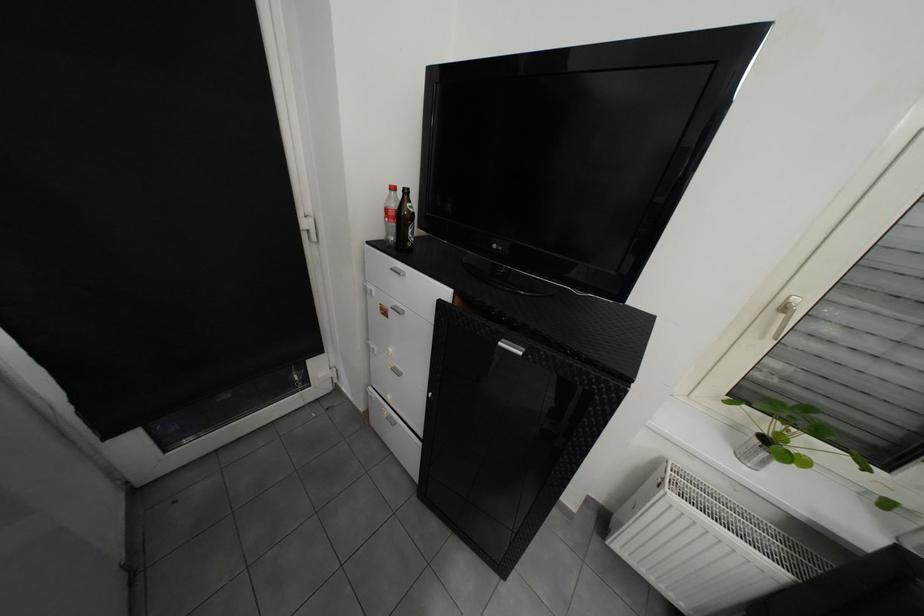
Which object does [757,450] point to?

It corresponds to the small plant pot in the image.